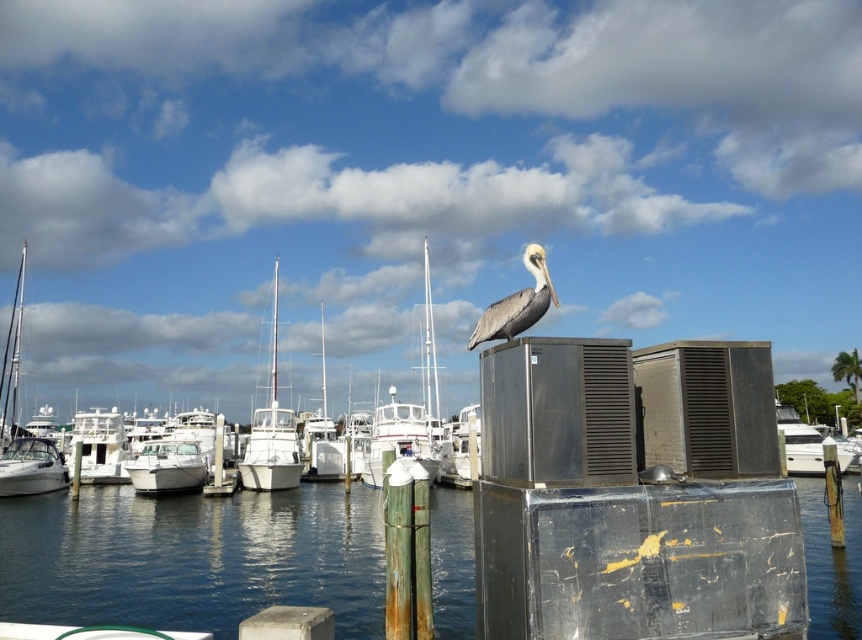
Can you confirm if white glossy boat at center is smaller than white glossy boat at right?

Correct, white glossy boat at center occupies less space than white glossy boat at right.

Between white glossy boat at center and white glossy boat at right, which one is positioned higher?

white glossy boat at right is above.

The width and height of the screenshot is (862, 640). What do you see at coordinates (398, 440) in the screenshot? I see `white glossy boat at center` at bounding box center [398, 440].

At what (x,y) coordinates should I click in order to perform the action: click on white glossy boat at center. Please return your answer as a coordinate pair (x, y). Looking at the image, I should click on (x=398, y=440).

Does white glossy boat at center have a smaller size compared to white glossy boat at left?

No, white glossy boat at center is not smaller than white glossy boat at left.

Between white glossy boat at center and white glossy boat at left, which one appears on the right side from the viewer's perspective?

white glossy boat at center

Find the location of `white glossy boat at center`. white glossy boat at center is located at coordinates (398, 440).

Between point (404, 413) and point (539, 253), which one is positioned in front?

Point (539, 253) is more forward.

Who is more distant from viewer, (361, 476) or (523, 330)?

The point (361, 476) is more distant.

Locate an element on the screen. This screenshot has height=640, width=862. white glossy boat at center is located at coordinates (398, 440).